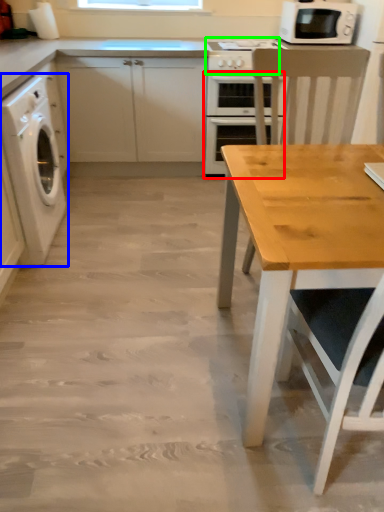
Question: Estimate the real-world distances between objects in this image. Which object is farther from oven (highlighted by a red box), washing machine (highlighted by a blue box) or gas stove (highlighted by a green box)?

Choices:
 (A) washing machine
 (B) gas stove

Answer: (A)